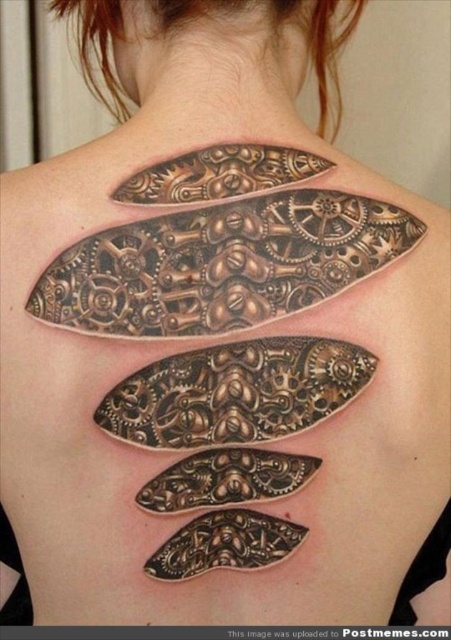
Question: Is brushed metal gear at upper center positioned before bronze metallic gear at center?

Choices:
 (A) yes
 (B) no

Answer: (A)

Question: Does bronze metallic gear at center have a greater width compared to bronze metallic gear at upper center?

Choices:
 (A) no
 (B) yes

Answer: (B)

Question: Among these objects, which one is nearest to the camera?

Choices:
 (A) bronze metallic gear at center
 (B) brushed metal gear at upper center
 (C) black textured gear at center

Answer: (B)

Question: Estimate the real-world distances between objects in this image. Which object is farther from the bronze metallic gear at upper center?

Choices:
 (A) bronze metallic gear at center
 (B) black textured gear at center
 (C) brushed metal gear at upper center

Answer: (B)

Question: Is brushed metal gear at upper center closer to the viewer compared to black textured gear at center?

Choices:
 (A) no
 (B) yes

Answer: (B)

Question: Which point is farther to the camera?

Choices:
 (A) (224, 154)
 (B) (229, 381)

Answer: (A)